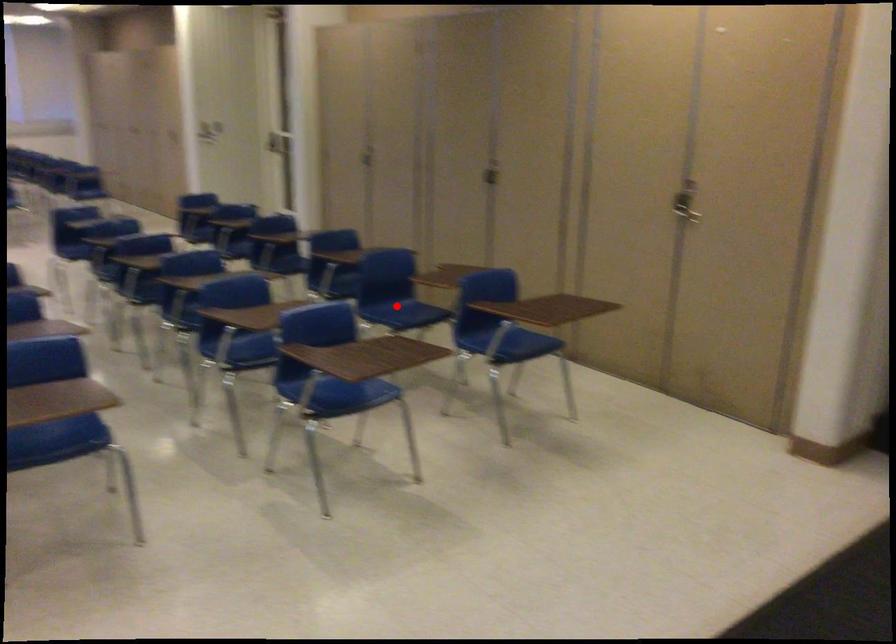
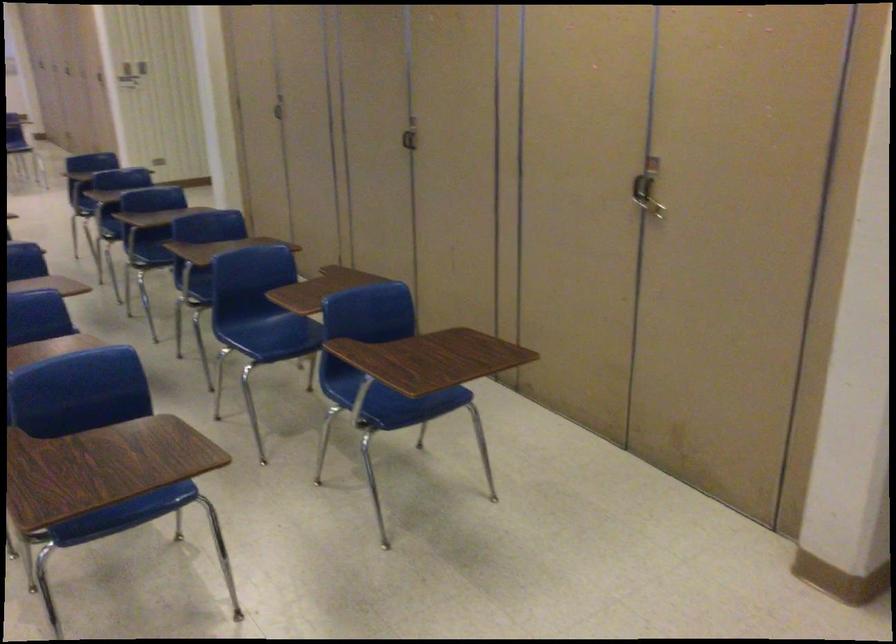
Question: I am providing you with two images of the same scene from different viewpoints. Image1 has a red point marked. In image2, the corresponding 3D location appears at what relative position? Reply with the corresponding letter.

Choices:
 (A) Closer
 (B) Farther

Answer: (A)